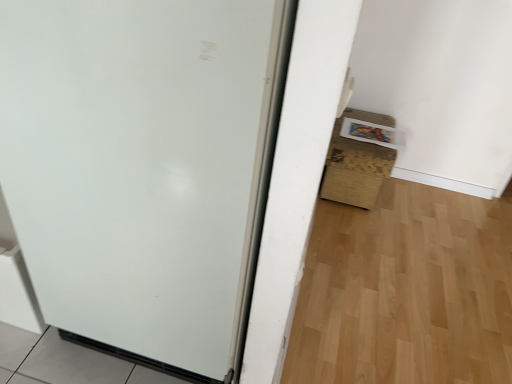
Image resolution: width=512 pixels, height=384 pixels. In order to click on vacant space in front of brown cardboard box at lower right in this screenshot , I will do `click(373, 235)`.